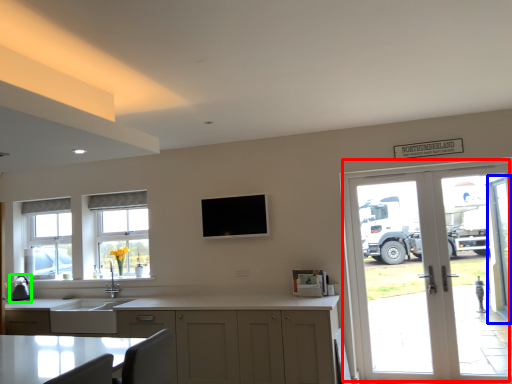
Question: Considering the real-world distances, which object is farthest from door (highlighted by a red box)? screen door (highlighted by a blue box) or appliance (highlighted by a green box)?

Choices:
 (A) screen door
 (B) appliance

Answer: (B)